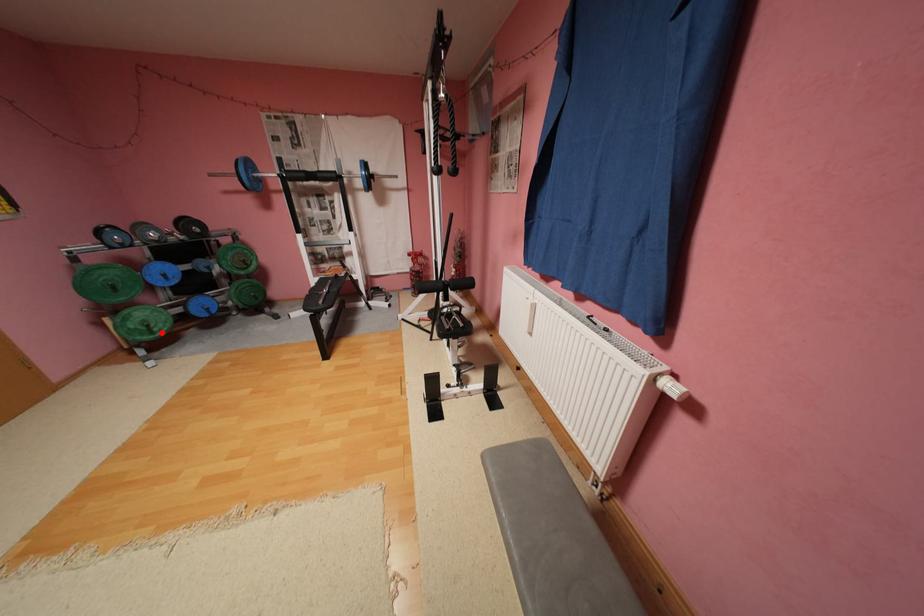
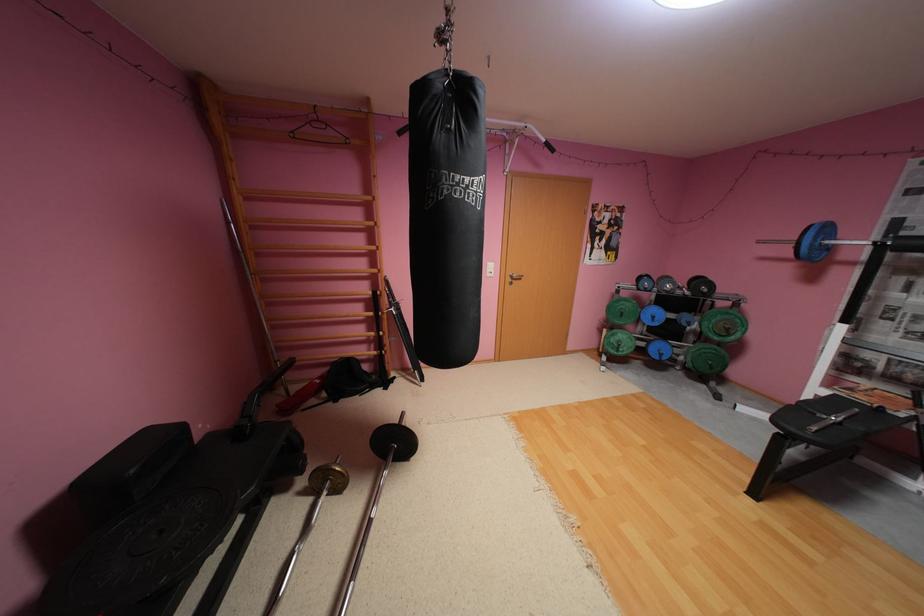
Find the pixel in the second image that matches the highlighted location in the first image.

(626, 351)